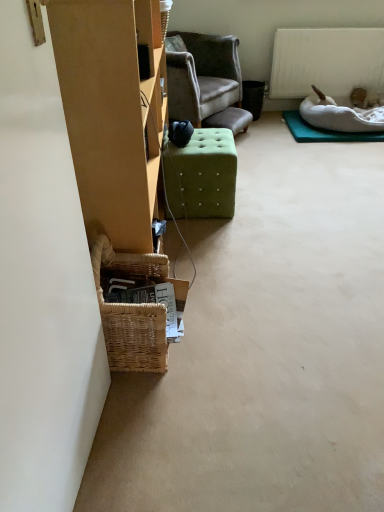
Question: Is the position of white matte radiator at upper right less distant than that of white fabric mat at upper right?

Choices:
 (A) no
 (B) yes

Answer: (A)

Question: Does white matte radiator at upper right have a greater width compared to white fabric mat at upper right?

Choices:
 (A) yes
 (B) no

Answer: (B)

Question: Is white matte radiator at upper right facing away from white fabric mat at upper right?

Choices:
 (A) yes
 (B) no

Answer: (B)

Question: Is white matte radiator at upper right oriented towards white fabric mat at upper right?

Choices:
 (A) yes
 (B) no

Answer: (A)

Question: Is white matte radiator at upper right to the right of white fabric mat at upper right from the viewer's perspective?

Choices:
 (A) yes
 (B) no

Answer: (B)

Question: Based on their sizes in the image, would you say white soft dog bed at upper right is bigger or smaller than white fabric mat at upper right?

Choices:
 (A) small
 (B) big

Answer: (B)

Question: From a real-world perspective, is white soft dog bed at upper right physically located above or below white fabric mat at upper right?

Choices:
 (A) above
 (B) below

Answer: (A)

Question: From their relative heights in the image, would you say white soft dog bed at upper right is taller or shorter than white fabric mat at upper right?

Choices:
 (A) short
 (B) tall

Answer: (B)

Question: Visually, is white soft dog bed at upper right positioned to the left or to the right of white fabric mat at upper right?

Choices:
 (A) right
 (B) left

Answer: (A)

Question: From their relative heights in the image, would you say woven wicker basket at lower left is taller or shorter than green fabric ottoman at center?

Choices:
 (A) tall
 (B) short

Answer: (A)

Question: Is woven wicker basket at lower left situated inside green fabric ottoman at center or outside?

Choices:
 (A) inside
 (B) outside

Answer: (B)

Question: Visually, is woven wicker basket at lower left positioned to the left or to the right of green fabric ottoman at center?

Choices:
 (A) left
 (B) right

Answer: (A)

Question: Considering their positions, is woven wicker basket at lower left located in front of or behind green fabric ottoman at center?

Choices:
 (A) behind
 (B) front

Answer: (B)

Question: From a real-world perspective, is green fabric ottoman at center positioned above or below woven wicker basket at lower left?

Choices:
 (A) below
 (B) above

Answer: (A)

Question: Is green fabric ottoman at center in front of or behind woven wicker basket at lower left in the image?

Choices:
 (A) front
 (B) behind

Answer: (B)